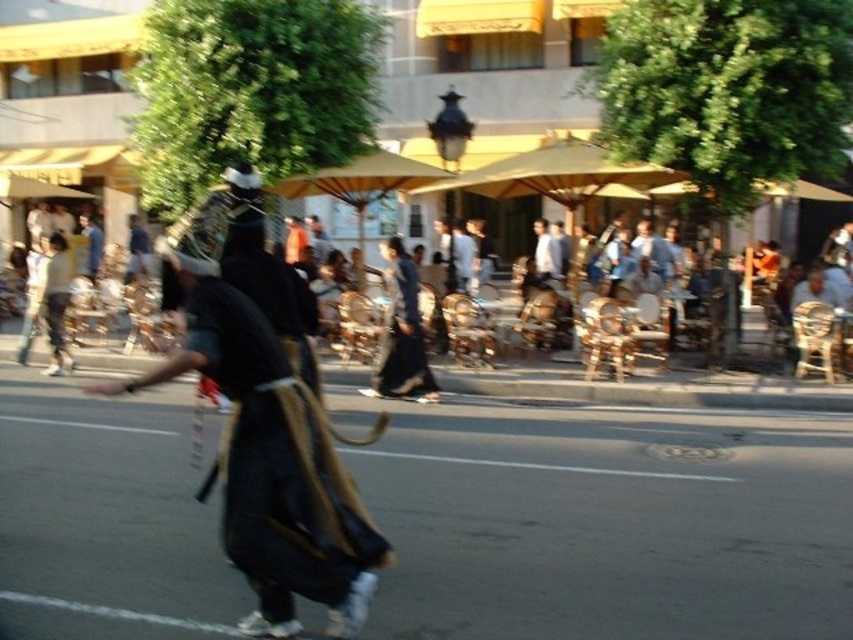
You are a photographer trying to capture the two dark blue fabrics in the scene. The dark blue fabric dress at center and the dark blue fabric at center are both in your viewfinder. Which one appears wider in the photo?

The dark blue fabric dress at center might be wider than dark blue fabric at center according to the description.

You are standing at the origin point of the image coordinate system. You want to locate the black fabric mask at center. In which direction should you move relative to your current position?

The black fabric mask at center is located at coordinates point (271,467). Since the origin is at the bottom left corner, you should move to the right and upwards to reach it.